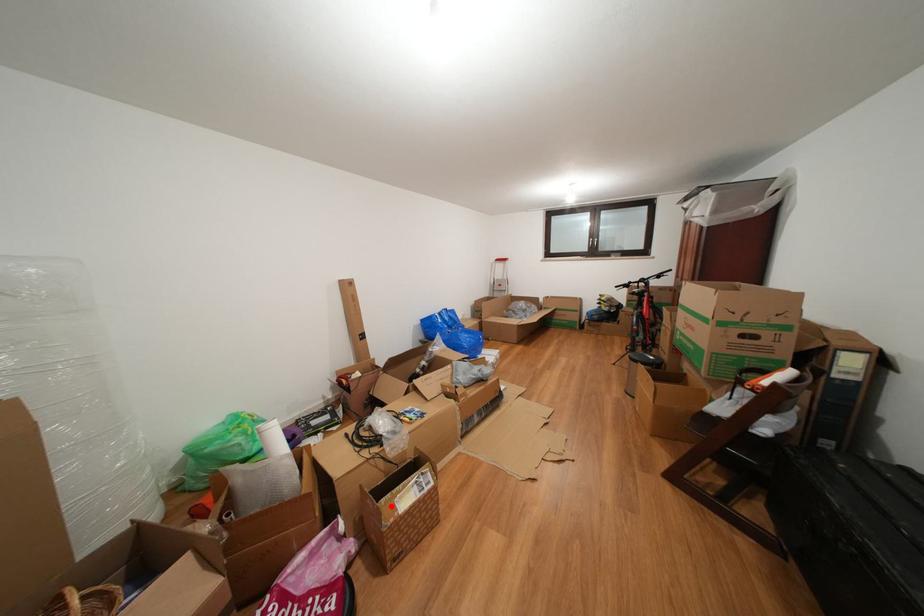
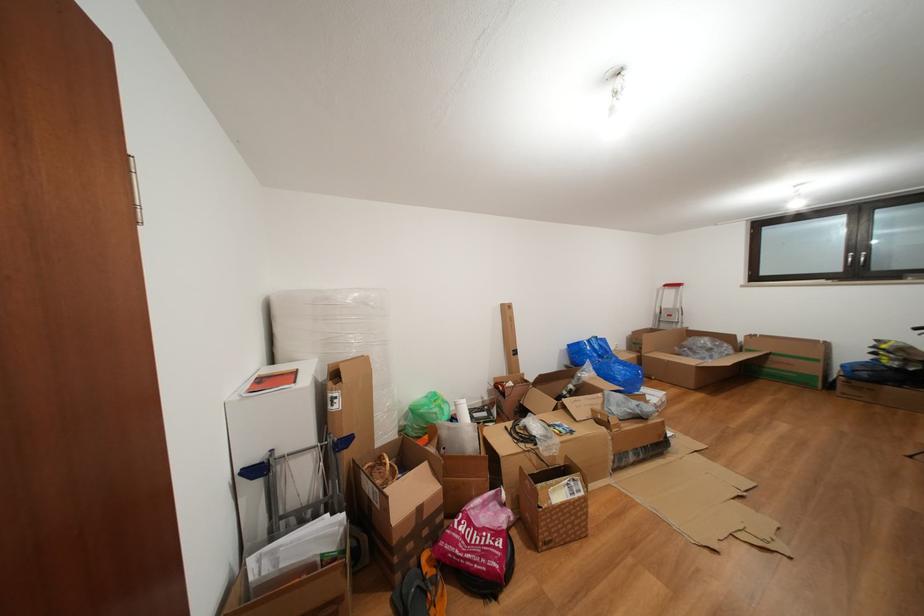
Question: I am providing you with two images of the same scene from different viewpoints. Image1 has a red point marked. In image2, the corresponding 3D location appears at what relative position? Reply with the corresponding letter.

Choices:
 (A) Closer
 (B) Farther

Answer: (A)